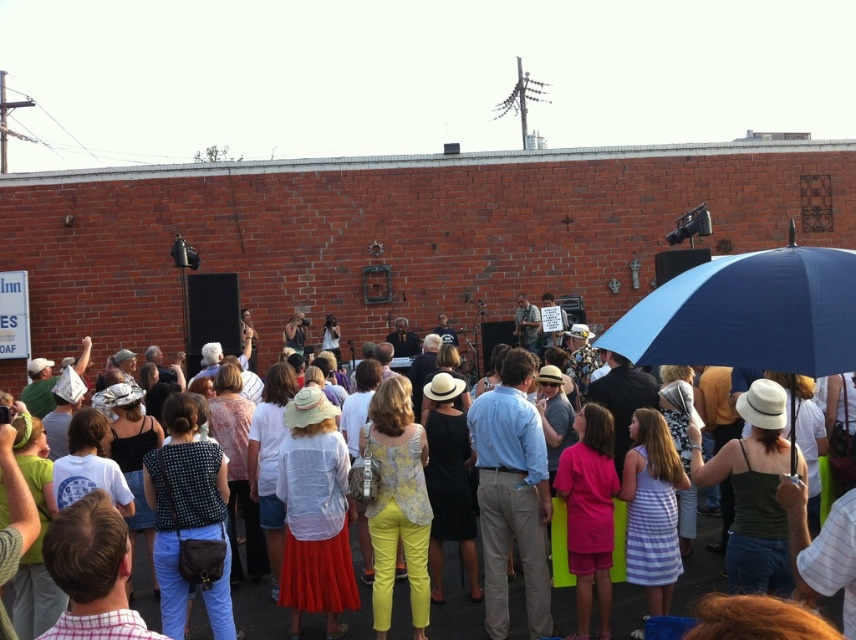
Is blue matte umbrella at upper right further to the viewer compared to matte white shirt at center?

No, it is in front of matte white shirt at center.

Looking at this image, who is positioned more to the left, blue matte umbrella at upper right or matte white shirt at center?

Positioned to the left is matte white shirt at center.

Between point (740, 337) and point (459, 598), which one is positioned in front?

Point (740, 337) is more forward.

I want to click on blue matte umbrella at upper right, so click(749, 314).